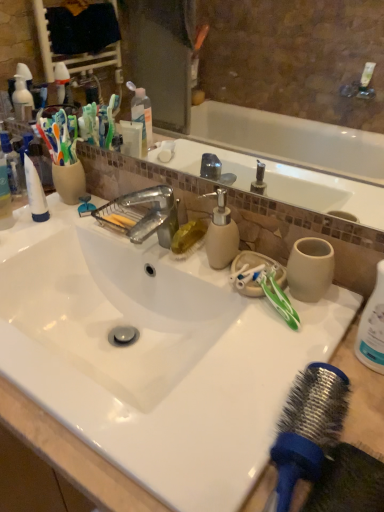
Describe the element at coordinates (35, 192) in the screenshot. I see `white glossy toothpaste at left` at that location.

Locate an element on the screen. Image resolution: width=384 pixels, height=512 pixels. white plastic bottle at right is located at coordinates (373, 327).

The height and width of the screenshot is (512, 384). What do you see at coordinates (308, 426) in the screenshot?
I see `blue rubber hair brush at lower right` at bounding box center [308, 426].

The image size is (384, 512). Describe the element at coordinates (277, 298) in the screenshot. I see `green plastic toothbrush at right` at that location.

The width and height of the screenshot is (384, 512). In order to click on white glossy toothpaste at left in this screenshot , I will do `click(35, 192)`.

Is glossy ceramic mirror at upper center next to green plastic toothbrush at right?

glossy ceramic mirror at upper center is not next to green plastic toothbrush at right, and they're not touching.

Considering the positions of objects glossy ceramic mirror at upper center and green plastic toothbrush at right in the image provided, who is more to the left, glossy ceramic mirror at upper center or green plastic toothbrush at right?

glossy ceramic mirror at upper center.

Between point (301, 57) and point (292, 322), which one is positioned in front?

Positioned in front is point (292, 322).

From the picture: Which object is further away from the camera, glossy ceramic mirror at upper center or green plastic toothbrush at right?

green plastic toothbrush at right is further from the camera.

From a real-world perspective, is green plastic toothbrush at right above or below glossy ceramic mirror at upper center?

Clearly, from a real-world perspective, green plastic toothbrush at right is below glossy ceramic mirror at upper center.

Is green plastic toothbrush at right far away from glossy ceramic mirror at upper center?

green plastic toothbrush at right is far away from glossy ceramic mirror at upper center.

Does green plastic toothbrush at right have a greater height compared to glossy ceramic mirror at upper center?

Incorrect, the height of green plastic toothbrush at right is not larger of that of glossy ceramic mirror at upper center.

This screenshot has width=384, height=512. In order to click on toothbrush on the right of glossy ceramic mirror at upper center in this screenshot , I will do `click(277, 298)`.

Where is `hair drier directly beneath the glossy ceramic mirror at upper center (from a real-world perspective)`? The image size is (384, 512). hair drier directly beneath the glossy ceramic mirror at upper center (from a real-world perspective) is located at coordinates (308, 426).

Would you say blue rubber hair brush at lower right is a long distance from glossy ceramic mirror at upper center?

Yes, blue rubber hair brush at lower right is far from glossy ceramic mirror at upper center.

From the image's perspective, is blue rubber hair brush at lower right under glossy ceramic mirror at upper center?

Yes, from the image's perspective, blue rubber hair brush at lower right is beneath glossy ceramic mirror at upper center.

Can you tell me how much blue rubber hair brush at lower right and glossy ceramic mirror at upper center differ in facing direction?

8.72 degrees separate the facing orientations of blue rubber hair brush at lower right and glossy ceramic mirror at upper center.

Who is smaller, white glossy sink at center or white plastic bottle at right?

white plastic bottle at right is smaller.

Is white glossy sink at center shorter than white plastic bottle at right?

Yes, white glossy sink at center is shorter than white plastic bottle at right.

Does white glossy sink at center touch white plastic bottle at right?

No, white glossy sink at center is not making contact with white plastic bottle at right.

Locate an element on the screen. Image resolution: width=384 pixels, height=512 pixels. sink below the white plastic bottle at right (from the image's perspective) is located at coordinates (153, 354).

Considering the relative positions of white glossy sink at center and glossy ceramic mirror at upper center in the image provided, is white glossy sink at center to the left of glossy ceramic mirror at upper center from the viewer's perspective?

Correct, you'll find white glossy sink at center to the left of glossy ceramic mirror at upper center.

Consider the image. What's the angular difference between white glossy sink at center and glossy ceramic mirror at upper center's facing directions?

The angular difference between white glossy sink at center and glossy ceramic mirror at upper center is 0.00689 degrees.

Does point (170, 273) come closer to viewer compared to point (267, 58)?

Yes, it is in front of point (267, 58).

From the image's perspective, relative to glossy ceramic mirror at upper center, is white glossy sink at center above or below?

Based on their image positions, white glossy sink at center is located beneath glossy ceramic mirror at upper center.

Considering the relative sizes of white plastic bottle at right and green plastic toothbrush at right in the image provided, is white plastic bottle at right wider than green plastic toothbrush at right?

Yes, white plastic bottle at right is wider than green plastic toothbrush at right.

Locate an element on the screen. This screenshot has width=384, height=512. cleaning product located below the green plastic toothbrush at right (from the image's perspective) is located at coordinates (373, 327).

Which is closer to the camera, (366, 360) or (263, 280)?

The point (366, 360) is closer.

Considering the relative sizes of white plastic bottle at right and green plastic toothbrush at right in the image provided, is white plastic bottle at right bigger than green plastic toothbrush at right?

Correct, white plastic bottle at right is larger in size than green plastic toothbrush at right.

Considering the relative sizes of white glossy sink at center and beige matte soap dispenser at center in the image provided, is white glossy sink at center taller than beige matte soap dispenser at center?

Incorrect, the height of white glossy sink at center is not larger of that of beige matte soap dispenser at center.

From the image's perspective, which object appears higher, white glossy sink at center or beige matte soap dispenser at center?

beige matte soap dispenser at center appears higher in the image.

Considering the relative sizes of white glossy sink at center and beige matte soap dispenser at center in the image provided, is white glossy sink at center smaller than beige matte soap dispenser at center?

Actually, white glossy sink at center might be larger than beige matte soap dispenser at center.

In the scene shown: From a real-world perspective, which is physically below, white glossy sink at center or beige matte soap dispenser at center?

white glossy sink at center, from a real-world perspective.

Where is `toothbrush that is below the glossy ceramic mirror at upper center (from the image's perspective)`? toothbrush that is below the glossy ceramic mirror at upper center (from the image's perspective) is located at coordinates (277, 298).

Image resolution: width=384 pixels, height=512 pixels. Find the location of `toothbrush directly beneath the glossy ceramic mirror at upper center (from a real-world perspective)`. toothbrush directly beneath the glossy ceramic mirror at upper center (from a real-world perspective) is located at coordinates (277, 298).

Based on their spatial positions, is beige matte soap dispenser at center or glossy ceramic mirror at upper center closer to white glossy sink at center?

beige matte soap dispenser at center.

Looking at the image, which one is located closer to green plastic toothbrush at right, beige matte soap dispenser at center or metallic faucet at center?

beige matte soap dispenser at center is positioned closer to the anchor green plastic toothbrush at right.

Considering their positions, is green plastic toothbrush at right positioned further to blue rubber hair brush at lower right than beige matte soap dispenser at center?

Based on the image, beige matte soap dispenser at center appears to be further to blue rubber hair brush at lower right.

Considering their positions, is metallic faucet at center positioned further to blue rubber hair brush at lower right than green plastic toothbrush at right?

metallic faucet at center is positioned further to the anchor blue rubber hair brush at lower right.

From the image, which object appears to be nearer to white glossy sink at center, metallic faucet at center or white plastic bottle at right?

metallic faucet at center.

Estimate the real-world distances between objects in this image. Which object is closer to glossy ceramic mirror at upper center, white glossy sink at center or white glossy toothpaste at left?

white glossy toothpaste at left lies closer to glossy ceramic mirror at upper center than the other object.

Estimate the real-world distances between objects in this image. Which object is further from green plastic toothbrush at right, blue rubber hair brush at lower right or white glossy toothpaste at left?

white glossy toothpaste at left is further to green plastic toothbrush at right.

When comparing their distances from blue rubber hair brush at lower right, does glossy ceramic mirror at upper center or white plastic bottle at right seem closer?

white plastic bottle at right is closer to blue rubber hair brush at lower right.

Find the location of a particular element. The width and height of the screenshot is (384, 512). sink between blue rubber hair brush at lower right and white glossy toothpaste at left from front to back is located at coordinates (153, 354).

Identify the location of sink located between white glossy toothpaste at left and green plastic toothbrush at right in the left-right direction. (153, 354).

This screenshot has height=512, width=384. I want to click on tap that lies between glossy ceramic mirror at upper center and green plastic toothbrush at right from top to bottom, so click(153, 214).

Identify the location of sink between glossy ceramic mirror at upper center and blue rubber hair brush at lower right from top to bottom. The image size is (384, 512). (153, 354).